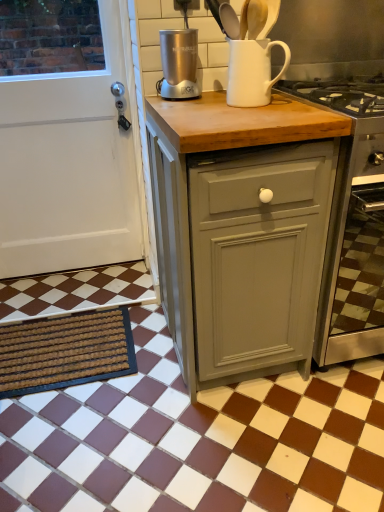
The width and height of the screenshot is (384, 512). Find the location of `unoccupied area in front of matte gray cabinet at center`. unoccupied area in front of matte gray cabinet at center is located at coordinates (236, 444).